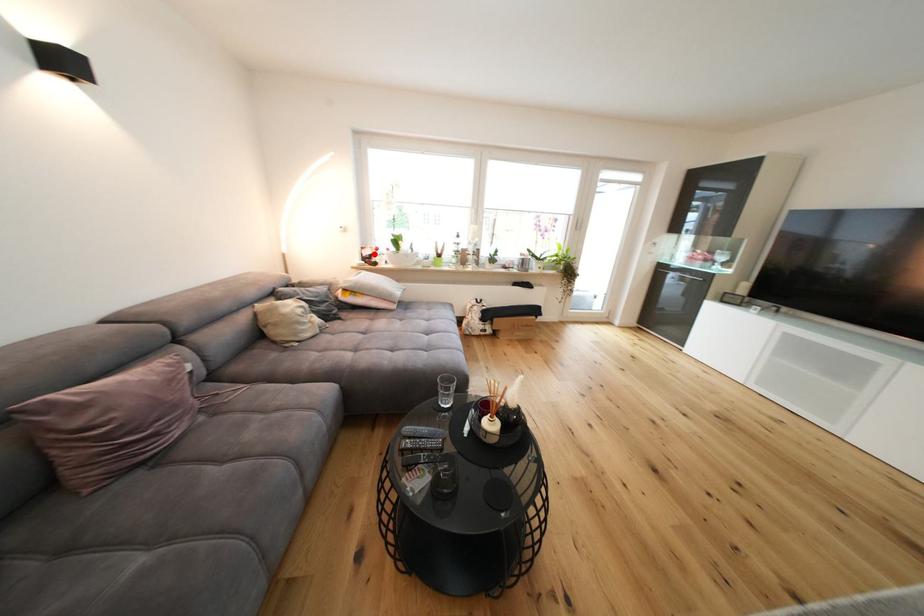
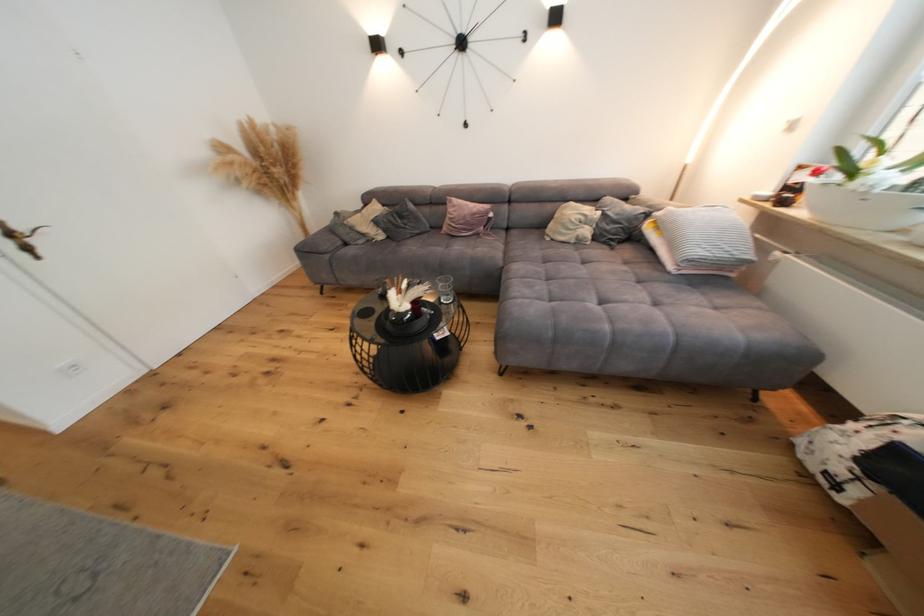
Where in the second image is the point corresponding to the highlighted location from the first image?

(809, 179)